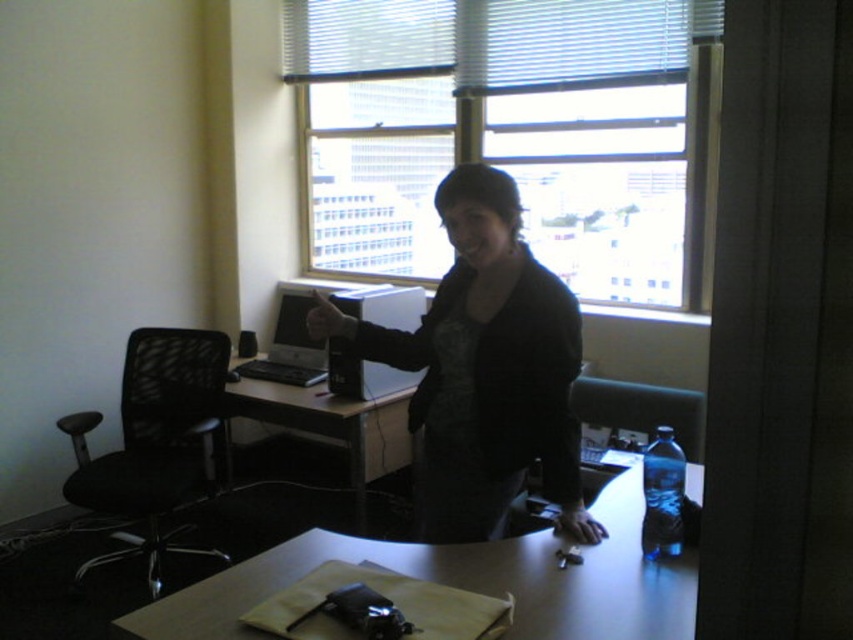
Looking at this image, is transparent glass window at upper center below black mesh swivel chair at left?

Incorrect, transparent glass window at upper center is not positioned below black mesh swivel chair at left.

Which is more to the right, transparent glass window at upper center or black mesh swivel chair at left?

transparent glass window at upper center is more to the right.

Locate an element on the screen. This screenshot has height=640, width=853. transparent glass window at upper center is located at coordinates (514, 132).

Is matte black desk at center positioned behind matte black desktop computer at center?

That is True.

Is point (386, 401) farther from camera compared to point (412, 330)?

No, (386, 401) is closer to viewer.

Which is behind, point (410, 444) or point (397, 385)?

The point (410, 444) is behind.

I want to click on matte black desk at center, so click(x=332, y=422).

Is point (549, 301) more distant than point (289, 339)?

No, it is not.

Is point (567, 417) positioned before point (285, 304)?

Yes, point (567, 417) is closer to viewer.

I want to click on black matte shirt at center, so tap(485, 369).